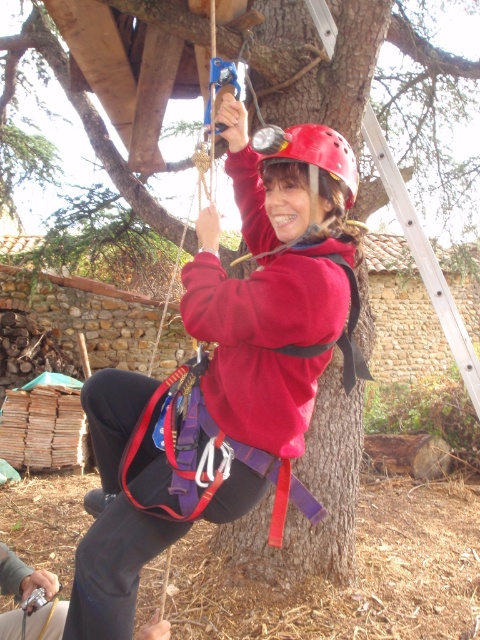
In the scene shown: You are standing at the base of the tree and see two points marked on the trunk. The first point is at coordinates point (196, 337) and the second is at point (319, 140). Which point is closer to you?

Point (196, 337) is in front of point (319, 140), so it is closer to you.

You are a safety inspector checking the equipment of a tree worker. You notice the matte red jacket at center and the red matte helmet at center. Which piece of equipment is positioned to the right of the other?

The matte red jacket at center is to the left of the red matte helmet at center, so the red matte helmet at center is positioned to the right of the matte red jacket at center.

You are a safety inspector assessing the equipment of a tree worker. You notice the matte red jacket at center and the red matte helmet at center. Which piece of equipment is wider?

The matte red jacket at center is wider than the red matte helmet at center, as its width surpasses the helmet.